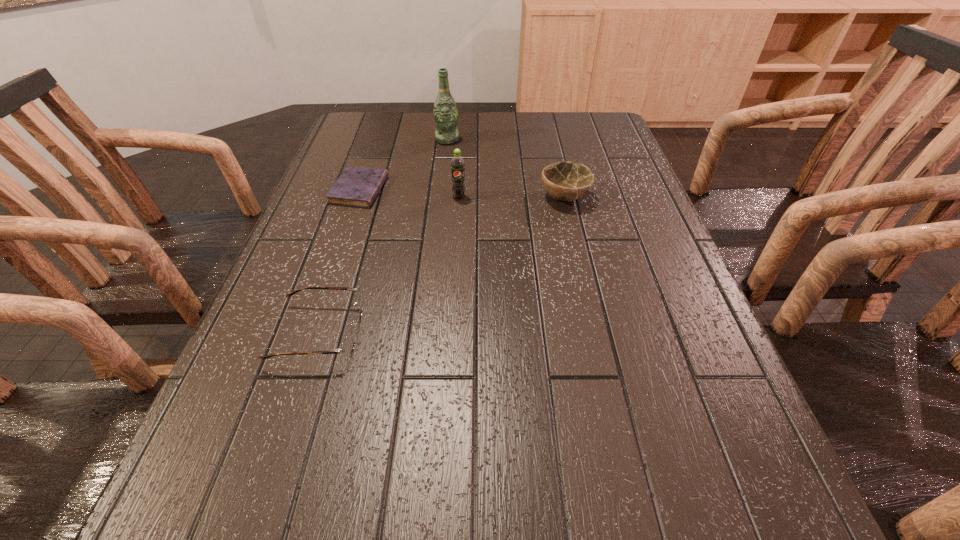
This screenshot has width=960, height=540. Identify the location of free spot between the diary and the farthest object. (403, 165).

At what (x,y) coordinates should I click in order to perform the action: click on object identified as the third closest to the tallest object. Please return your answer as a coordinate pair (x, y). Looking at the image, I should click on (566, 181).

Select which object appears as the second closest to the rightmost object. Please provide its 2D coordinates. Your answer should be formatted as a tuple, i.e. [(x, y)], where the tuple contains the x and y coordinates of a point satisfying the conditions above.

[(445, 113)]

Locate an element on the screen. free space in the image that satisfies the following two spatial constraints: 1. on the surface of the farthest object; 2. on the front-facing side of the spectacles is located at coordinates (426, 333).

Locate an element on the screen. The image size is (960, 540). free space that satisfies the following two spatial constraints: 1. on the front side of the rightmost object; 2. on the front-facing side of the spectacles is located at coordinates (596, 333).

In order to click on vacant position in the image that satisfies the following two spatial constraints: 1. on the front label of the soda; 2. on the front-facing side of the spectacles in this screenshot , I will do `click(451, 333)`.